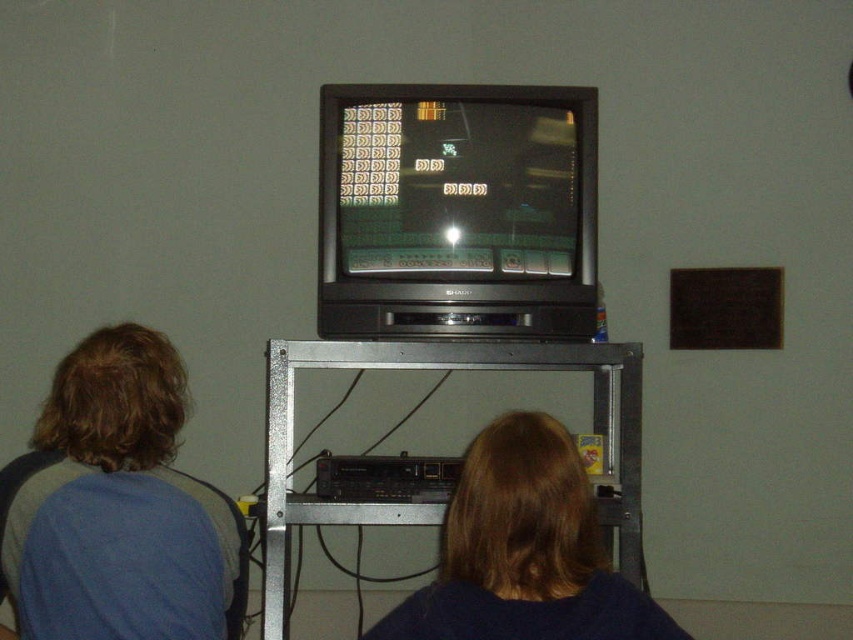
Question: Is black plastic tv at center to the left of dark blue sweater at lower center from the viewer's perspective?

Choices:
 (A) yes
 (B) no

Answer: (A)

Question: Which point appears closest to the camera in this image?

Choices:
 (A) (434, 582)
 (B) (440, 176)

Answer: (B)

Question: Which point is closer to the camera?

Choices:
 (A) blue fabric shirt at left
 (B) black plastic tv at center
 (C) dark blue sweater at lower center

Answer: (C)

Question: Is black plastic tv at center further to the viewer compared to blue fabric shirt at left?

Choices:
 (A) no
 (B) yes

Answer: (B)

Question: Can you confirm if blue fabric shirt at left is positioned to the right of dark blue sweater at lower center?

Choices:
 (A) no
 (B) yes

Answer: (A)

Question: Which object is the farthest from the dark blue sweater at lower center?

Choices:
 (A) black plastic tv at center
 (B) blue fabric shirt at left

Answer: (A)